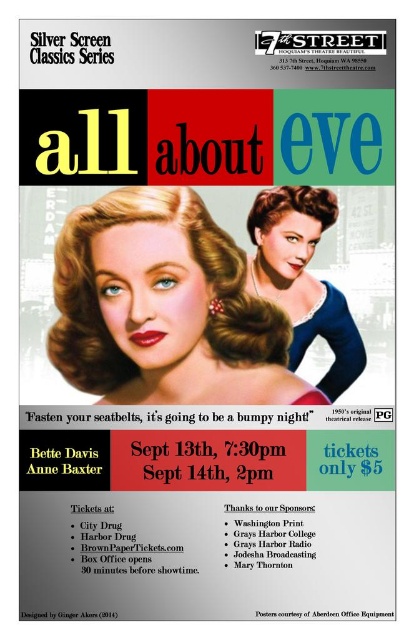
Question: Observing the image, what is the correct spatial positioning of matte blonde hair at center in reference to blue satin dress at center?

Choices:
 (A) left
 (B) right

Answer: (A)

Question: Among these points, which one is nearest to the camera?

Choices:
 (A) (180, 200)
 (B) (319, 208)

Answer: (A)

Question: Which point is farther to the camera?

Choices:
 (A) (139, 214)
 (B) (262, 237)

Answer: (B)

Question: Is matte blonde hair at center in front of blue satin dress at center?

Choices:
 (A) yes
 (B) no

Answer: (A)

Question: Is matte blonde hair at center in front of blue satin dress at center?

Choices:
 (A) yes
 (B) no

Answer: (A)

Question: Which object appears farthest from the camera in this image?

Choices:
 (A) blue satin dress at center
 (B) matte blonde hair at center

Answer: (A)